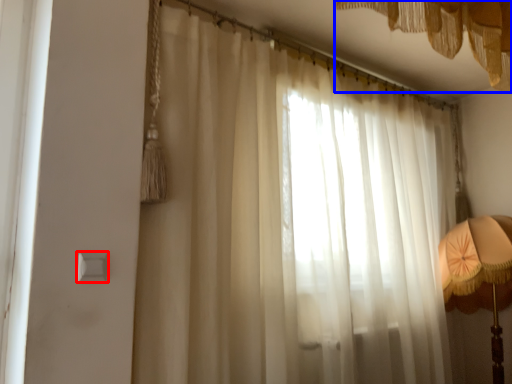
Question: Which object is further to the camera taking this photo, light switch (highlighted by a red box) or curtain (highlighted by a blue box)?

Choices:
 (A) light switch
 (B) curtain

Answer: (A)